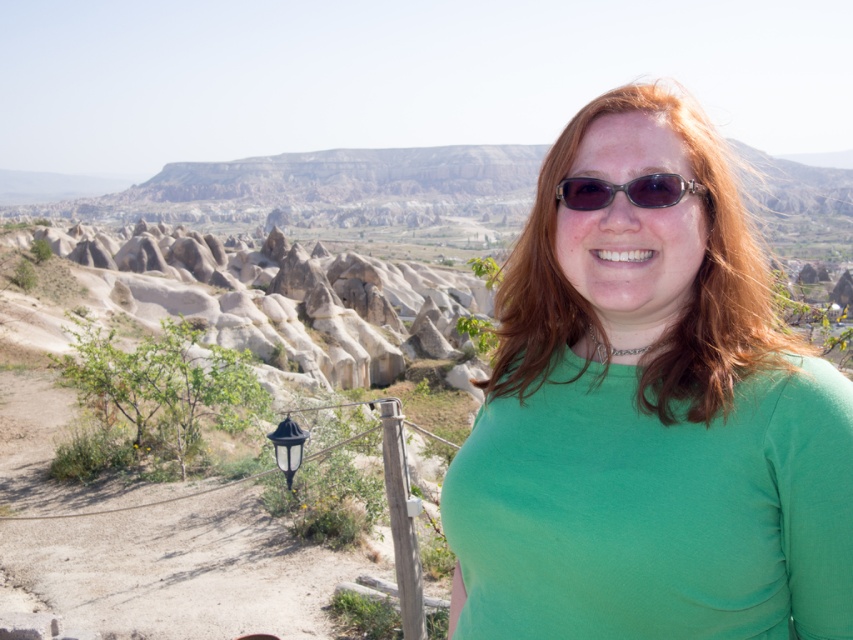
Question: Does green matte shirt at center have a larger size compared to brown textured sunglasses at center?

Choices:
 (A) no
 (B) yes

Answer: (B)

Question: Observing the image, what is the correct spatial positioning of green matte shirt at center in reference to brown textured sunglasses at center?

Choices:
 (A) above
 (B) below

Answer: (B)

Question: Among these points, which one is farthest from the camera?

Choices:
 (A) (753, 627)
 (B) (637, 186)

Answer: (B)

Question: Is green matte shirt at center behind brown textured sunglasses at center?

Choices:
 (A) no
 (B) yes

Answer: (A)

Question: Which point is closer to the camera?

Choices:
 (A) green matte shirt at center
 (B) brown textured sunglasses at center

Answer: (A)